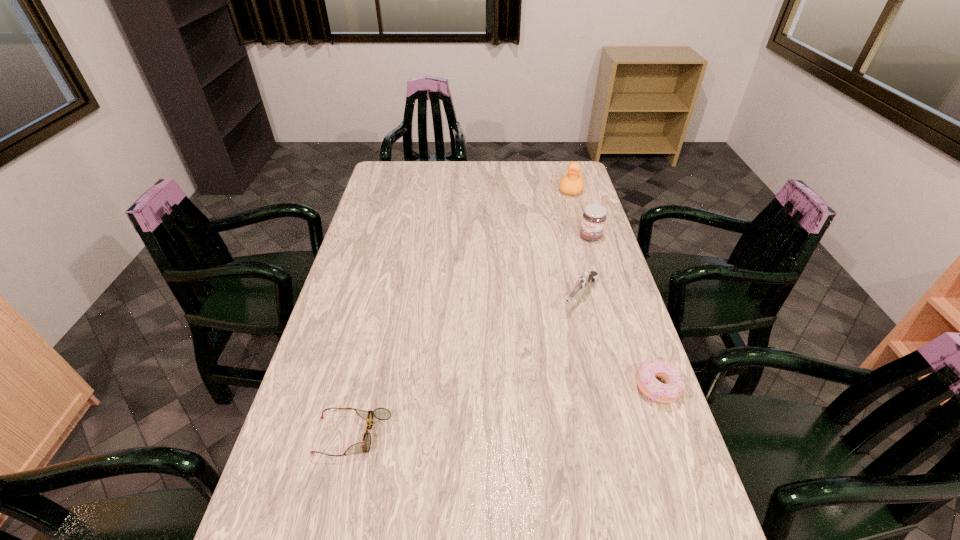
In order to click on the shortest object in this screenshot , I will do `click(380, 413)`.

I want to click on spectacles, so click(x=380, y=413).

Locate an element on the screen. This screenshot has height=540, width=960. the fourth farthest object is located at coordinates (648, 370).

Locate an element on the screen. doughnut is located at coordinates (648, 370).

Identify the location of the third tallest object. The image size is (960, 540). (585, 279).

At what (x,y) coordinates should I click in order to perform the action: click on the third nearest object. Please return your answer as a coordinate pair (x, y). The image size is (960, 540). Looking at the image, I should click on (585, 279).

At what (x,y) coordinates should I click in order to perform the action: click on the farthest object. Please return your answer as a coordinate pair (x, y). The height and width of the screenshot is (540, 960). Looking at the image, I should click on (572, 183).

Locate an element on the screen. the second farthest object is located at coordinates (594, 216).

The height and width of the screenshot is (540, 960). I want to click on vacant space located 0.050m on the front-facing side of the spectacles, so point(295,436).

Find the location of a particular element. This screenshot has width=960, height=540. vacant space located 0.240m on the back of the fourth farthest object is located at coordinates (629, 305).